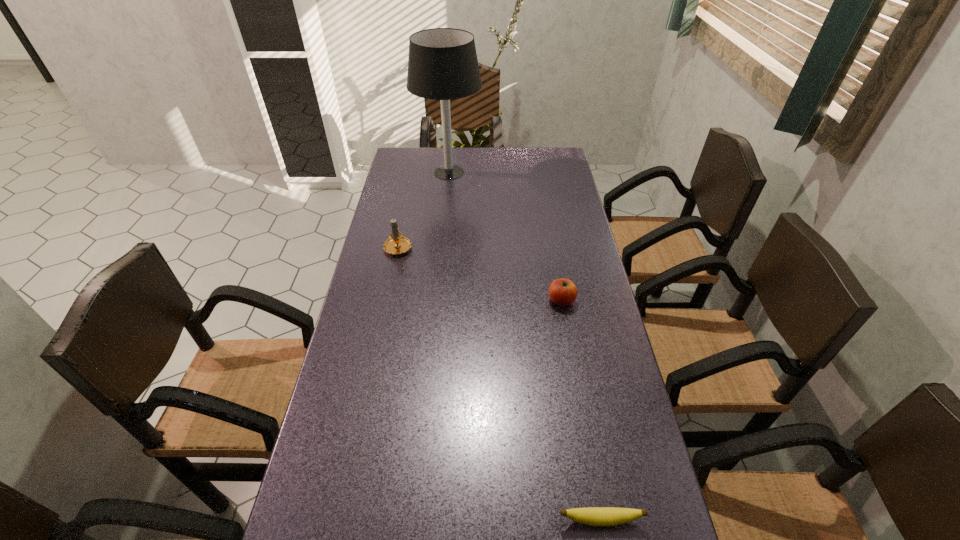
Where is `vacant space at the right edge`? The image size is (960, 540). vacant space at the right edge is located at coordinates (615, 529).

Locate an element on the screen. vacant space at the far left corner of the desktop is located at coordinates (x=415, y=176).

This screenshot has height=540, width=960. In order to click on vacant space that is in between the tallest object and the second shortest object in this screenshot , I will do `click(505, 237)`.

Where is `free spot between the farthest object and the apple`? Image resolution: width=960 pixels, height=540 pixels. free spot between the farthest object and the apple is located at coordinates (505, 237).

At what (x,y) coordinates should I click in order to perform the action: click on free spot between the tallest object and the second nearest object. Please return your answer as a coordinate pair (x, y). The width and height of the screenshot is (960, 540). Looking at the image, I should click on (505, 237).

Find the location of a particular element. The width and height of the screenshot is (960, 540). vacant space in between the third farthest object and the nearest object is located at coordinates (581, 410).

You are a GUI agent. You are given a task and a screenshot of the screen. Output one action in this format:
    pyautogui.click(x=<x>, y=<y>)
    Task: Click on the object that is the second nearest to the candle
    
    Given the screenshot: What is the action you would take?
    click(563, 292)

Locate which object ranks second in proximity to the nearest object. Please provide its 2D coordinates. Your answer should be formatted as a tuple, i.e. [(x, y)], where the tuple contains the x and y coordinates of a point satisfying the conditions above.

[(397, 244)]

I want to click on vacant space that satisfies the following two spatial constraints: 1. on the back side of the candle; 2. on the left side of the table lamp, so click(x=414, y=172).

I want to click on vacant region that satisfies the following two spatial constraints: 1. on the back side of the second farthest object; 2. on the right side of the tallest object, so click(414, 172).